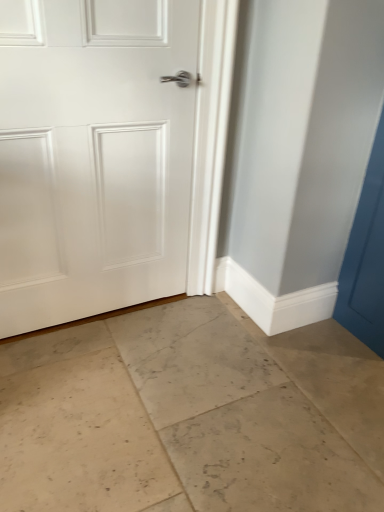
What are the coordinates of `vacant point above beige marble floor at center (from a real-world perspective)` in the screenshot? It's located at (217, 395).